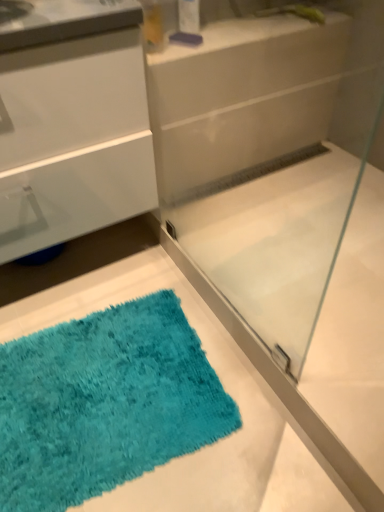
Question: Is white glossy counter at upper center bigger or smaller than turquoise shaggy bath mat at lower left?

Choices:
 (A) small
 (B) big

Answer: (A)

Question: Would you say white glossy counter at upper center is to the left or to the right of turquoise shaggy bath mat at lower left in the picture?

Choices:
 (A) left
 (B) right

Answer: (B)

Question: Considering the real-world distances, which object is farthest from the white glossy counter at upper center?

Choices:
 (A) turquoise shaggy bath mat at lower left
 (B) transparent glass shower door at center

Answer: (A)

Question: Based on their relative distances, which object is nearer to the white glossy counter at upper center?

Choices:
 (A) turquoise shaggy bath mat at lower left
 (B) transparent glass shower door at center

Answer: (B)